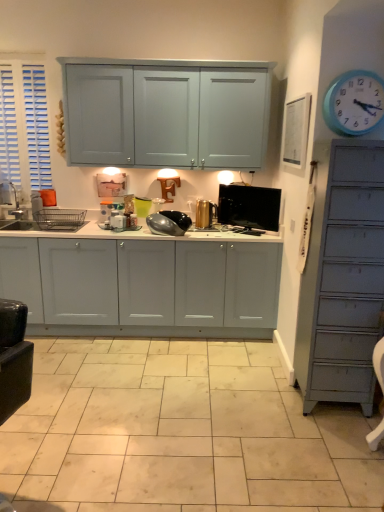
Locate an element on the screen. This screenshot has height=512, width=384. vacant point above blue plastic clock at upper right (from a real-world perspective) is located at coordinates pyautogui.click(x=359, y=70).